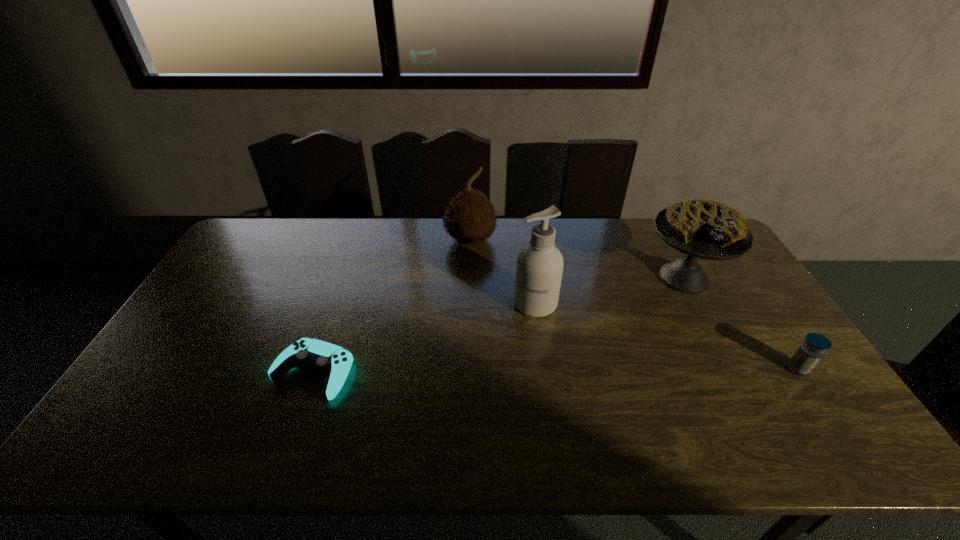
Find the location of a particular element. Image resolution: width=960 pixels, height=540 pixels. vacant space located 0.110m on the cut side of the fourth object from left to right is located at coordinates (650, 320).

Locate an element on the screen. The image size is (960, 540). free spot located on the cut side of the fourth object from left to right is located at coordinates (659, 309).

The height and width of the screenshot is (540, 960). In order to click on vacant point located on the cut side of the fourth object from left to right in this screenshot , I will do `click(637, 335)`.

Where is `vacant region located 0.250m on the front label of the third object from left to right`? This screenshot has width=960, height=540. vacant region located 0.250m on the front label of the third object from left to right is located at coordinates (510, 386).

Image resolution: width=960 pixels, height=540 pixels. Identify the location of free location located on the front label of the third object from left to right. (517, 360).

You are a GUI agent. You are given a task and a screenshot of the screen. Output one action in this format:
    pyautogui.click(x=<x>, y=<y>)
    Task: Click on the free space located on the front label of the third object from left to right
    This screenshot has height=540, width=960.
    Given the screenshot: What is the action you would take?
    [525, 336]

Locate an element on the screen. Image resolution: width=960 pixels, height=540 pixels. vacant space situated on the surface of the coconut is located at coordinates (504, 271).

Where is `vacant area located 0.330m on the surface of the coconut`? Image resolution: width=960 pixels, height=540 pixels. vacant area located 0.330m on the surface of the coconut is located at coordinates (546, 310).

In order to click on free space located 0.330m on the surface of the coconut in this screenshot , I will do `click(546, 310)`.

The height and width of the screenshot is (540, 960). Identify the location of pie present at the far edge. (702, 229).